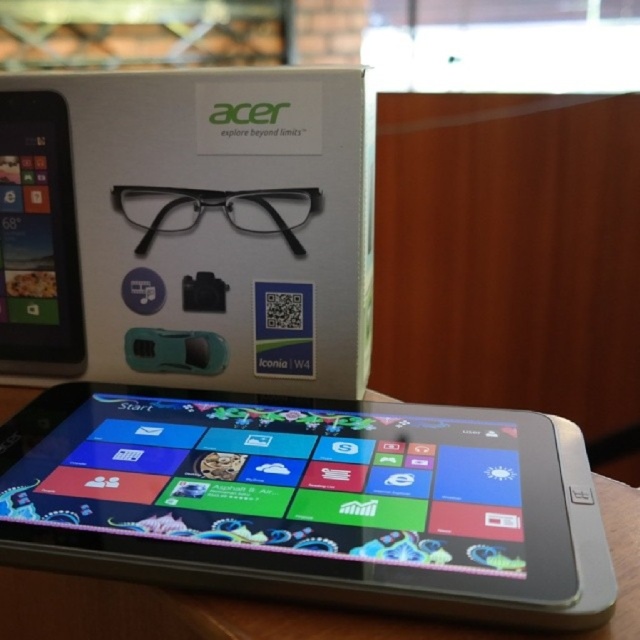
Does silver metallic tablet at center have a larger size compared to matte black tablet at left?

Yes, silver metallic tablet at center is bigger than matte black tablet at left.

This screenshot has width=640, height=640. What do you see at coordinates (310, 500) in the screenshot? I see `silver metallic tablet at center` at bounding box center [310, 500].

Is point (58, 410) farther from camera compared to point (51, 248)?

No, (58, 410) is in front of (51, 248).

The width and height of the screenshot is (640, 640). Identify the location of silver metallic tablet at center. (310, 500).

Between silver metallic tablet at center and white matte box at upper center, which one has less height?

silver metallic tablet at center is shorter.

Consider the image. Can you confirm if silver metallic tablet at center is positioned below white matte box at upper center?

Yes, silver metallic tablet at center is below white matte box at upper center.

This screenshot has height=640, width=640. I want to click on silver metallic tablet at center, so click(310, 500).

Between point (355, 358) and point (67, 141), which one is positioned behind?

The point (67, 141) is more distant.

Is white matte box at upper center above matte black tablet at left?

Actually, white matte box at upper center is below matte black tablet at left.

At what (x,y) coordinates should I click in order to perform the action: click on white matte box at upper center. Please return your answer as a coordinate pair (x, y). Image resolution: width=640 pixels, height=640 pixels. Looking at the image, I should click on (188, 228).